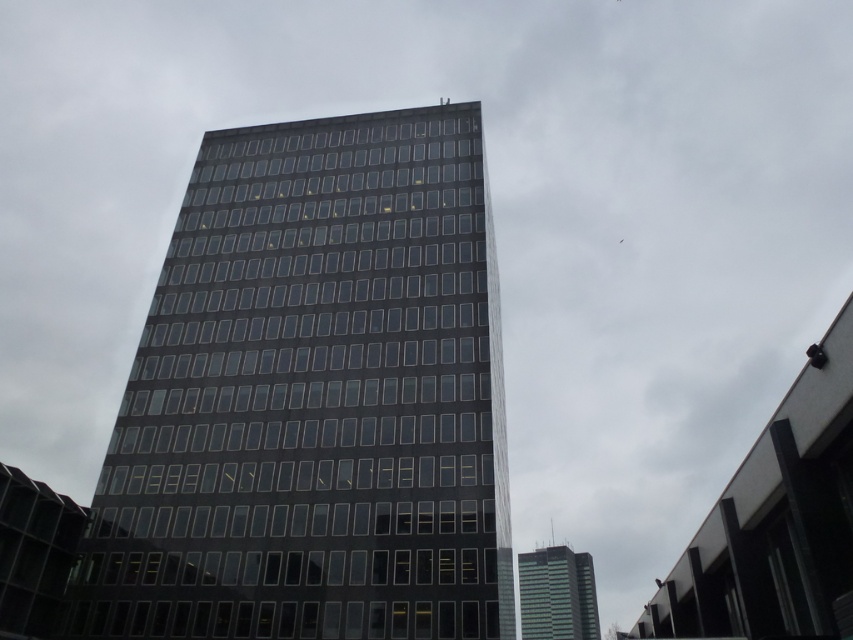
Is black glass building at center wider than green glass building at center?

Yes.

The height and width of the screenshot is (640, 853). Describe the element at coordinates (314, 397) in the screenshot. I see `black glass building at center` at that location.

Which is in front, point (445, 531) or point (589, 604)?

Point (445, 531) is in front.

The width and height of the screenshot is (853, 640). What are the coordinates of `black glass building at center` in the screenshot? It's located at (314, 397).